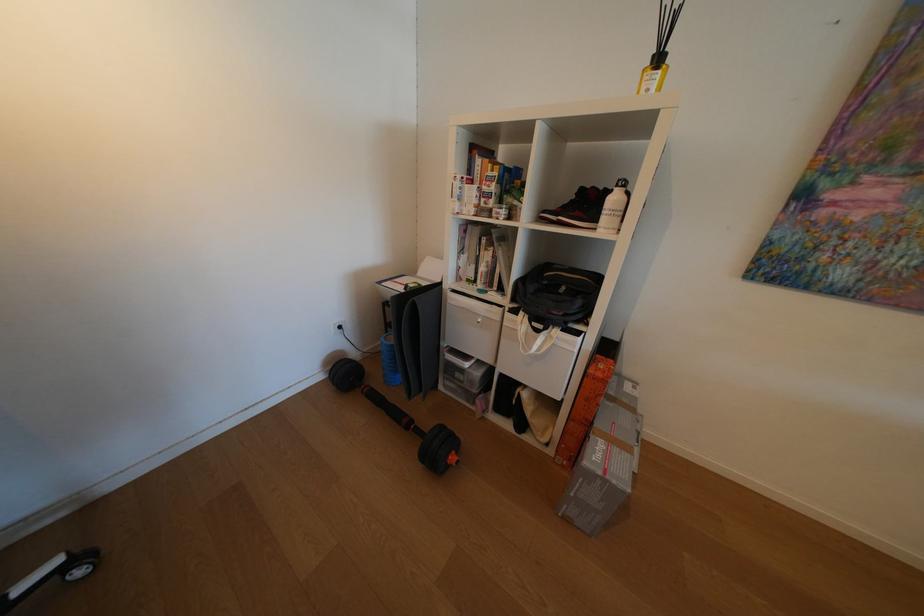
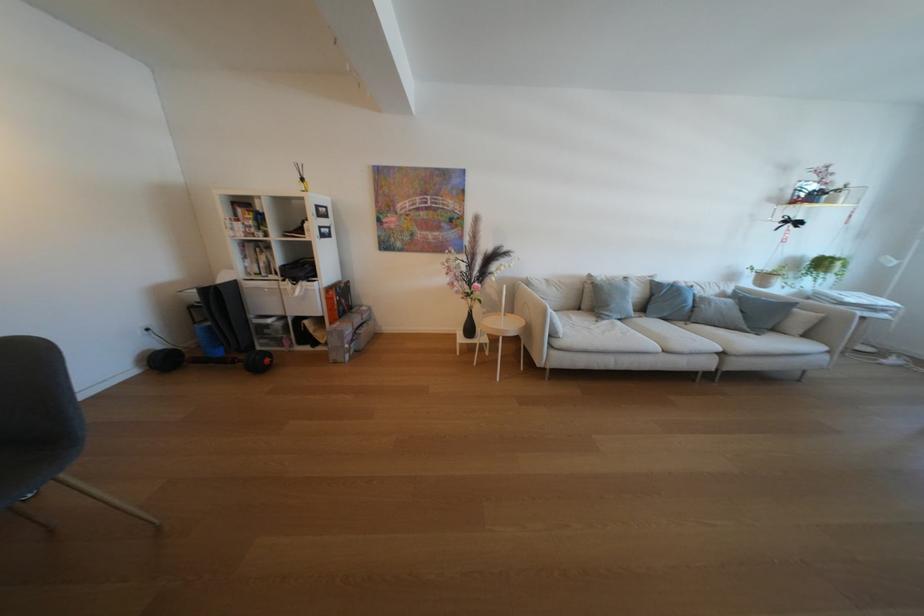
Where in the second image is the point corresponding to (x=446, y=387) from the first image?

(265, 351)